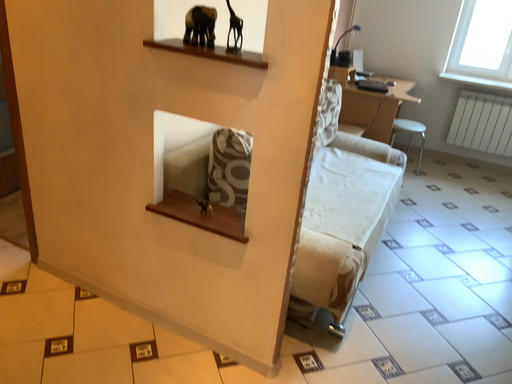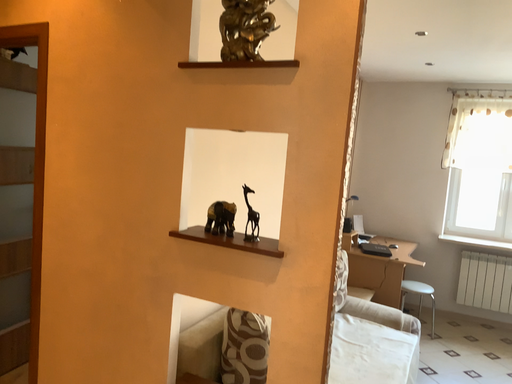
Question: How did the camera likely rotate when shooting the video?

Choices:
 (A) rotated downward
 (B) rotated upward

Answer: (B)